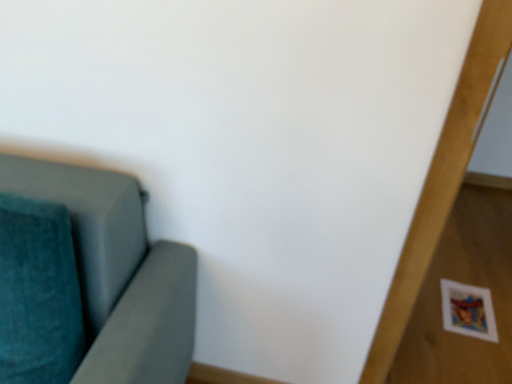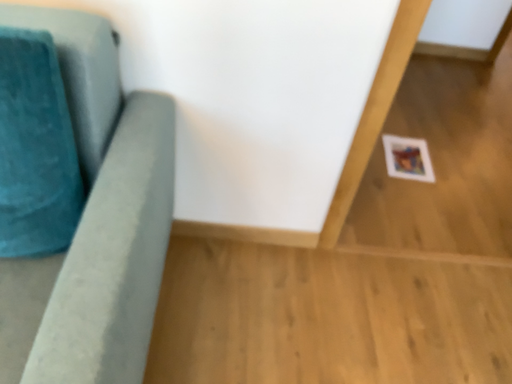
Question: How did the camera likely rotate when shooting the video?

Choices:
 (A) rotated upward
 (B) rotated downward

Answer: (B)